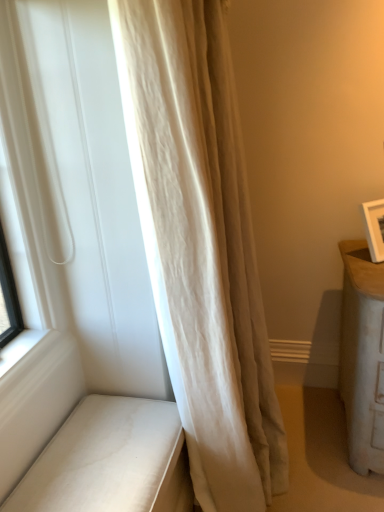
Question: Which is correct: beige silk curtain at left is inside white leather bench at lower left, or outside of it?

Choices:
 (A) outside
 (B) inside

Answer: (A)

Question: Relative to white leather bench at lower left, is beige silk curtain at left in front or behind?

Choices:
 (A) front
 (B) behind

Answer: (A)

Question: Is beige silk curtain at left taller or shorter than white leather bench at lower left?

Choices:
 (A) tall
 (B) short

Answer: (A)

Question: In terms of width, does white leather bench at lower left look wider or thinner when compared to beige silk curtain at left?

Choices:
 (A) wide
 (B) thin

Answer: (B)

Question: From a real-world perspective, relative to beige silk curtain at left, is white leather bench at lower left vertically above or below?

Choices:
 (A) below
 (B) above

Answer: (A)

Question: From the image's perspective, is white leather bench at lower left located above or below beige silk curtain at left?

Choices:
 (A) above
 (B) below

Answer: (B)

Question: Considering the positions of white leather bench at lower left and beige silk curtain at left in the image, is white leather bench at lower left bigger or smaller than beige silk curtain at left?

Choices:
 (A) big
 (B) small

Answer: (B)